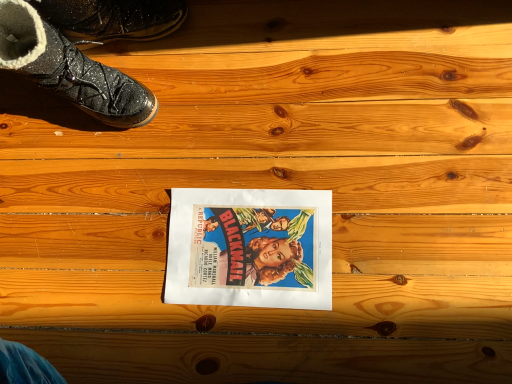
What are the coordinates of `vacant area that is in front of sparkly black boot at upper left, which is the 1th footwear from top to bottom` in the screenshot? It's located at (170, 100).